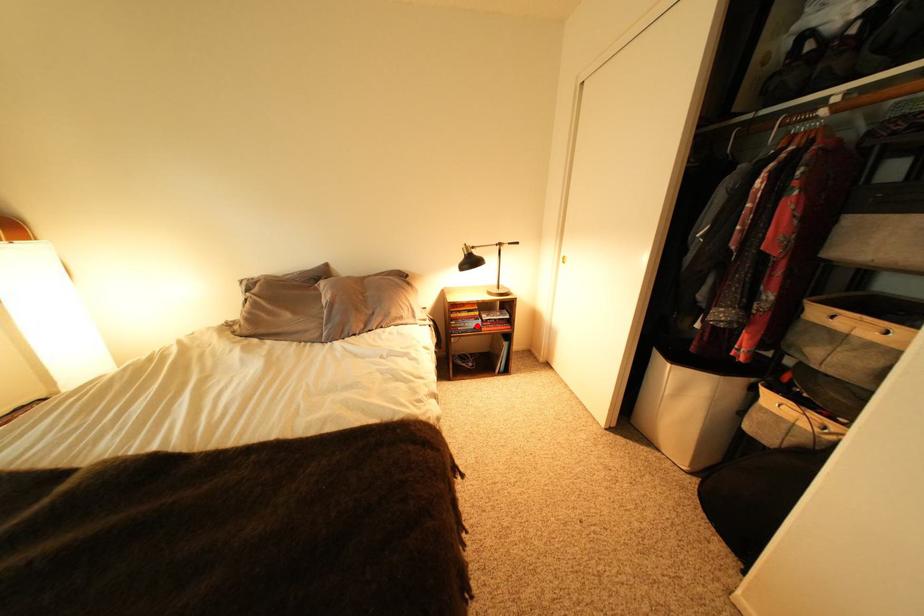
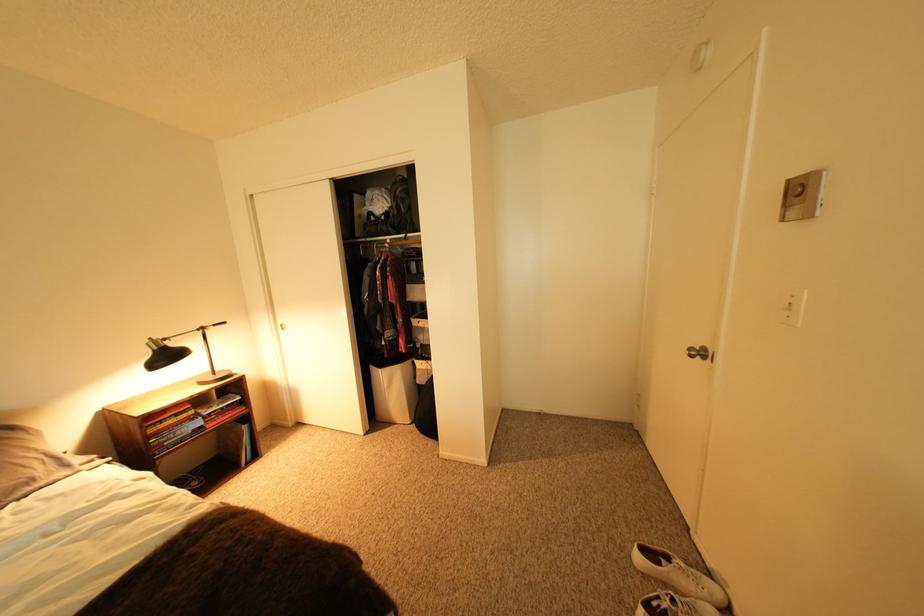
Question: I am providing you with two images of the same scene from different viewpoints. Given a red point in image1, look at the same physical point in image2. Is it:

Choices:
 (A) Closer to the viewpoint
 (B) Farther from the viewpoint

Answer: (A)